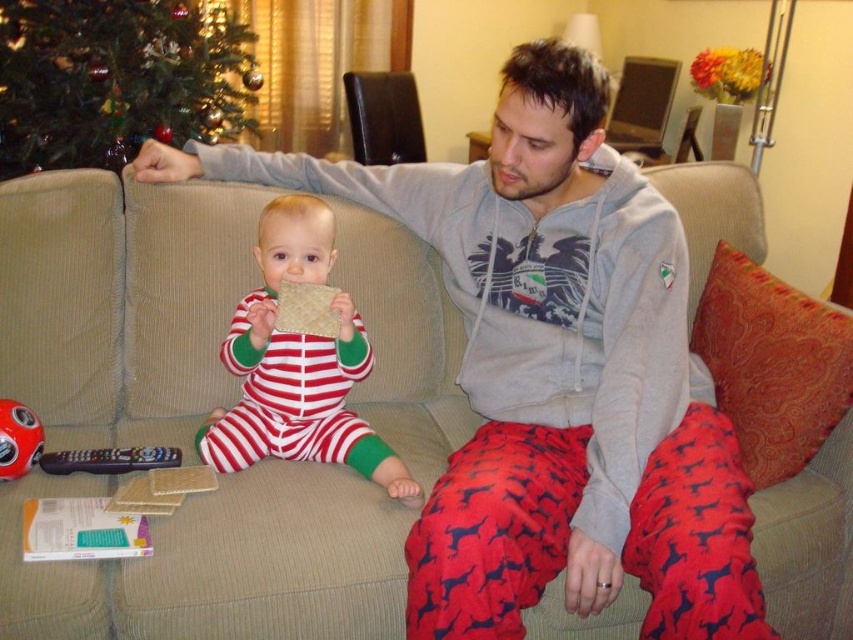
You are a parent trying to give your child a toy. The striped cotton onesie at center is where your child is sitting. The black plastic remote control at lower left is on the sofa. Can you reach the remote control from where your child is sitting?

The striped cotton onesie at center is 11.17 inches from the black plastic remote control at lower left, so yes, you can reach the remote control from where the child is sitting as the distance is within a comfortable reach.

You are a guest in this living room and want to place a new decorative item on the coffee table. The item is the same size as the black plastic remote control at lower left. Can you fit it next to the striped cotton onesie at center without overlapping?

The striped cotton onesie at center is bigger than the black plastic remote control at lower left. Since the decorative item is the same size as the remote control, it should fit next to the onesie without overlapping, as there is likely enough space around the larger onesie.